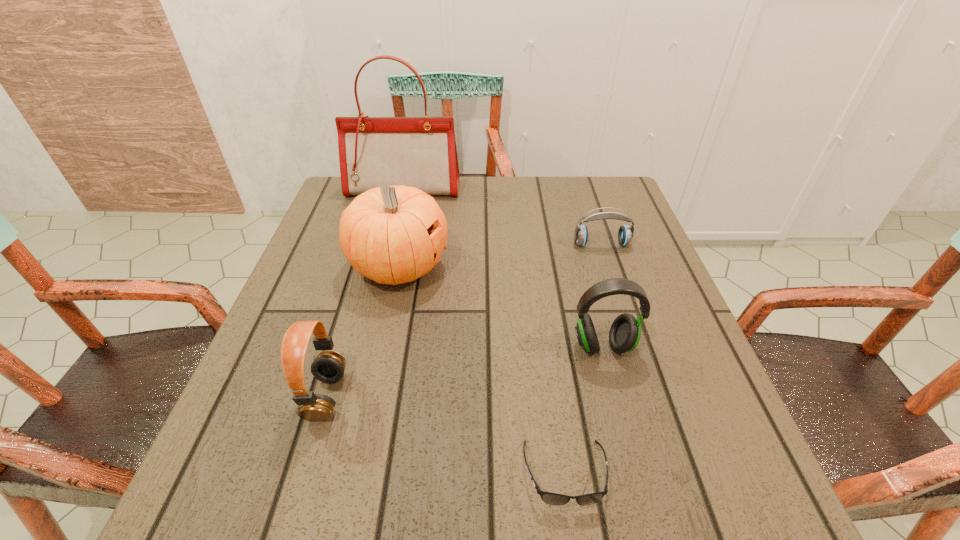
Where is `the tallest object`? the tallest object is located at coordinates tap(420, 152).

Where is `handbag`? This screenshot has width=960, height=540. handbag is located at coordinates coord(420,152).

The width and height of the screenshot is (960, 540). In order to click on the fifth shortest object in this screenshot , I will do `click(392, 235)`.

You are a GUI agent. You are given a task and a screenshot of the screen. Output one action in this format:
    pyautogui.click(x=<x>, y=<y>)
    Task: Click on the leftmost headset
    
    Given the screenshot: What is the action you would take?
    pyautogui.click(x=329, y=366)

The width and height of the screenshot is (960, 540). In order to click on the fifth farthest object in this screenshot , I will do `click(329, 366)`.

Locate an element on the screen. the third nearest object is located at coordinates (625, 332).

Identify the location of the farthest headset. The height and width of the screenshot is (540, 960). (625, 234).

Locate an element on the screen. the shortest headset is located at coordinates (625, 234).

Identify the location of sunglasses. The height and width of the screenshot is (540, 960). (550, 498).

Identify the location of the nearest object. This screenshot has width=960, height=540. (550, 498).